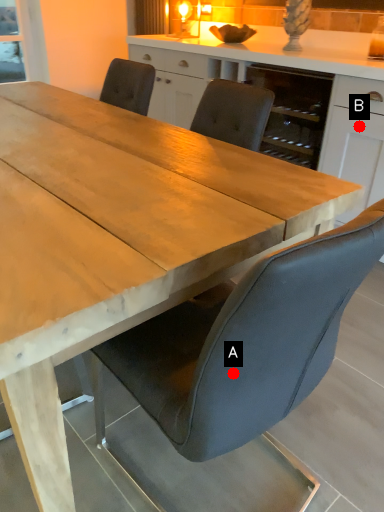
Question: Two points are circled on the image, labeled by A and B beside each circle. Which point is closer to the camera?

Choices:
 (A) A is closer
 (B) B is closer

Answer: (A)